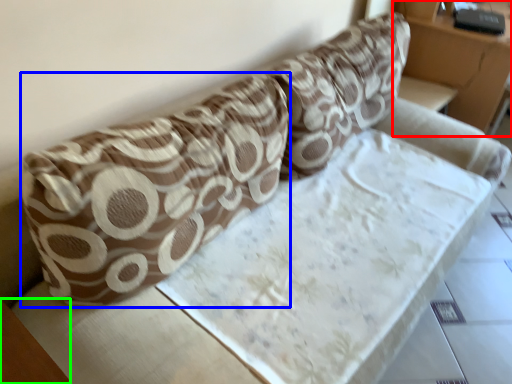
Question: Which object is the closest to the furniture (highlighted by a red box)? Choose among these: throw pillow (highlighted by a blue box) or table (highlighted by a green box).

Choices:
 (A) throw pillow
 (B) table

Answer: (A)